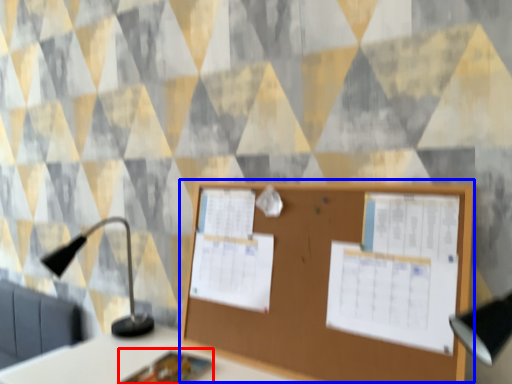
Question: Which object appears closest to the camera in this image, notebook (highlighted by a red box) or bulletin board (highlighted by a blue box)?

Choices:
 (A) notebook
 (B) bulletin board

Answer: (B)